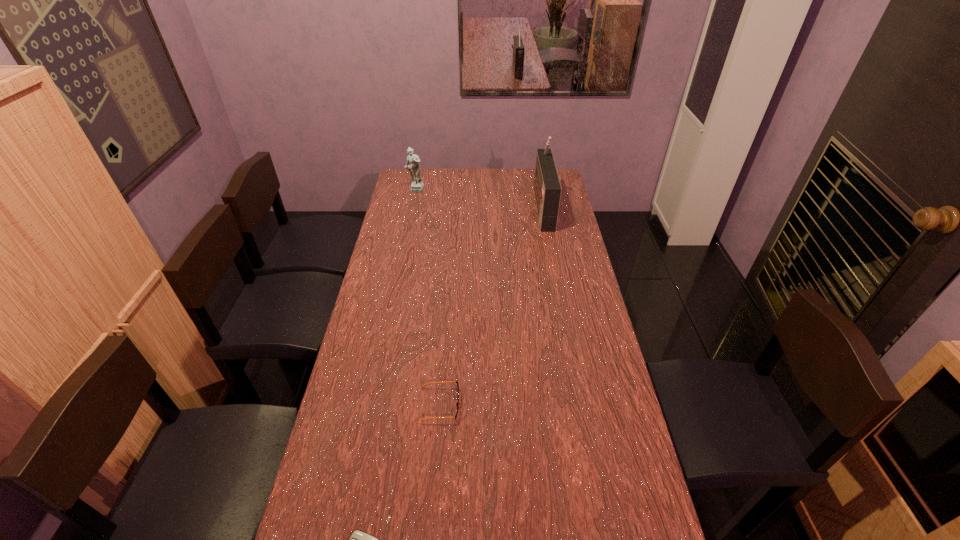
Where is `free spot between the figurine and the rightmost object`? The width and height of the screenshot is (960, 540). free spot between the figurine and the rightmost object is located at coordinates (479, 199).

Locate an element on the screen. The image size is (960, 540). blank region between the third object from left to right and the figurine is located at coordinates (427, 298).

This screenshot has height=540, width=960. I want to click on vacant space that is in between the second shortest object and the tallest object, so click(491, 306).

Choose which object is the third nearest neighbor to the rightmost object. Please provide its 2D coordinates. Your answer should be formatted as a tuple, i.e. [(x, y)], where the tuple contains the x and y coordinates of a point satisfying the conditions above.

[(359, 539)]

Identify the location of object that is the second closest to the tallest object. This screenshot has width=960, height=540. (457, 403).